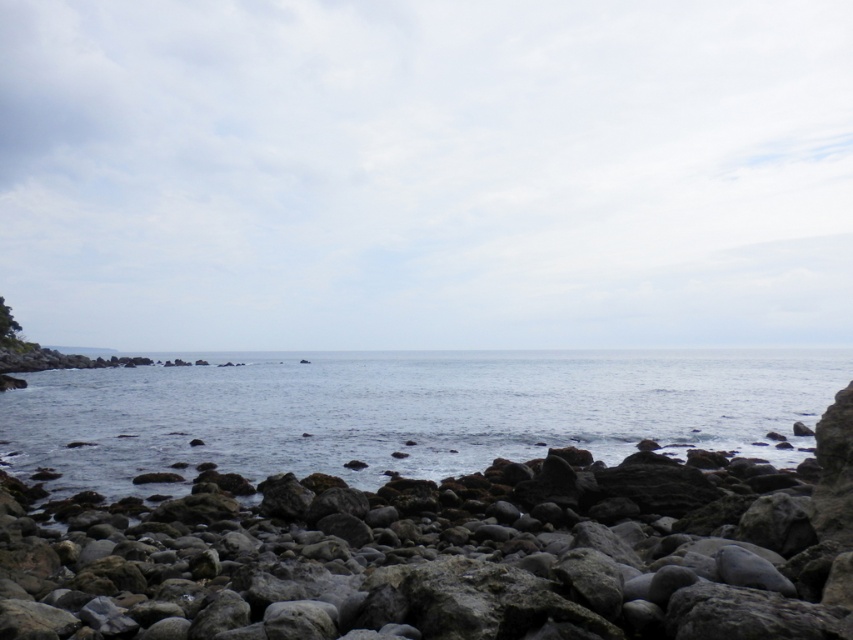
Does gray rock at center appear on the left side of clear blue water at center?

In fact, gray rock at center is to the right of clear blue water at center.

Does point (57, 513) come in front of point (724, 353)?

That is True.

Locate an element on the screen. The height and width of the screenshot is (640, 853). gray rock at center is located at coordinates click(x=451, y=554).